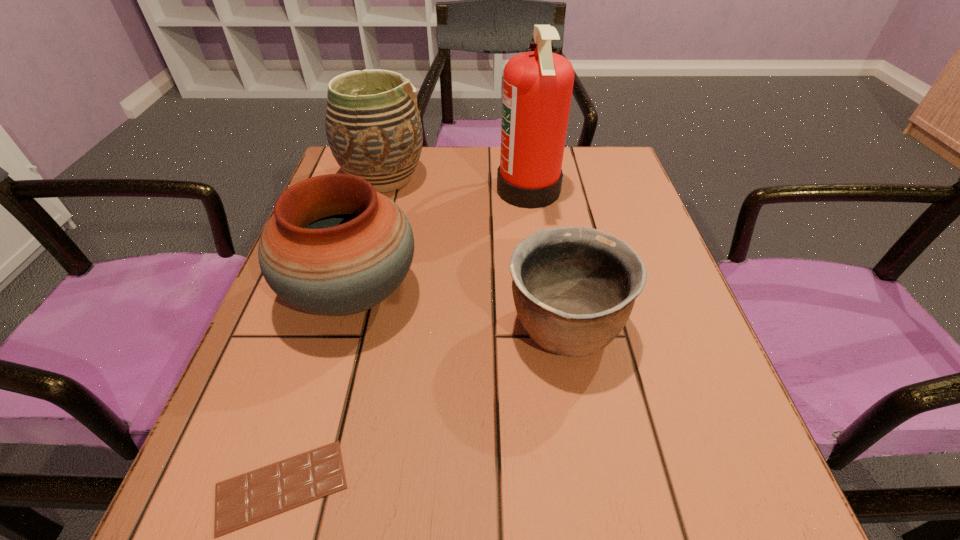
The image size is (960, 540). In order to click on vacant position in the image that satisfies the following two spatial constraints: 1. on the back side of the nearest object; 2. on the left side of the shortest pottery in this screenshot , I will do `click(330, 328)`.

Where is `vacant area in the image that satisfies the following two spatial constraints: 1. on the front side of the third shortest object; 2. on the left side of the farthest pottery`? vacant area in the image that satisfies the following two spatial constraints: 1. on the front side of the third shortest object; 2. on the left side of the farthest pottery is located at coordinates coord(351,293).

You are a GUI agent. You are given a task and a screenshot of the screen. Output one action in this format:
    pyautogui.click(x=<x>, y=<y>)
    Task: Click on the blank space that satisfies the following two spatial constraints: 1. on the back side of the second tallest pottery; 2. on the left side of the chocolate bar
    The height and width of the screenshot is (540, 960).
    Given the screenshot: What is the action you would take?
    pyautogui.click(x=341, y=293)